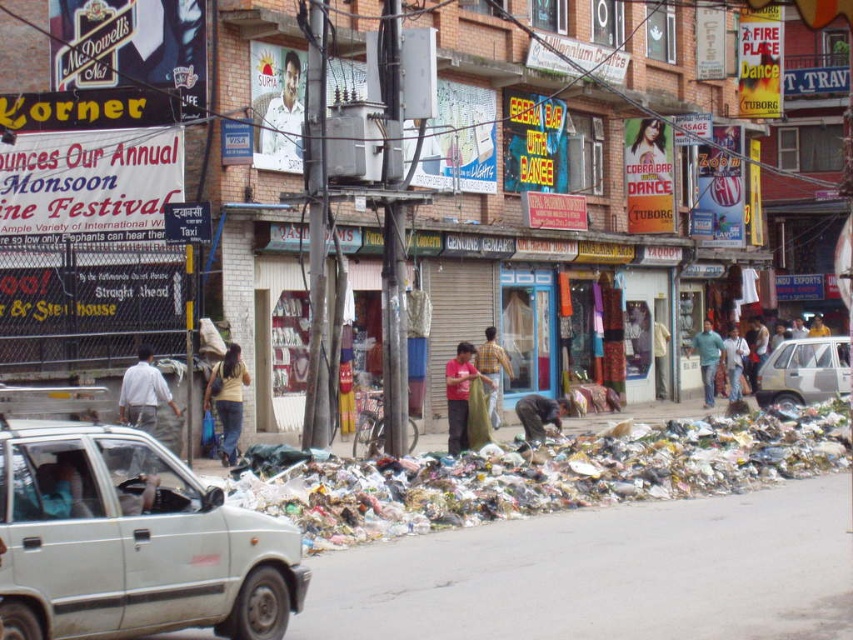
Is the position of white matte suv at lower left less distant than that of green matte shirt at center?

Yes, white matte suv at lower left is closer to the viewer.

Measure the distance between white matte suv at lower left and green matte shirt at center.

They are 74.27 feet apart.

Who is more forward, (230, 522) or (704, 378)?

Point (230, 522) is in front.

The image size is (853, 640). What are the coordinates of `white matte suv at lower left` in the screenshot? It's located at (132, 541).

Between light brown fabric bag at right and light gray fabric pants at center, which one appears on the right side from the viewer's perspective?

light brown fabric bag at right

Who is lower down, light brown fabric bag at right or light gray fabric pants at center?

light gray fabric pants at center

Identify the location of light brown fabric bag at right. This screenshot has height=640, width=853. (804, 371).

Who is shorter, red cotton shirt at center or green matte shirt at center?

red cotton shirt at center

Is red cotton shirt at center positioned behind green matte shirt at center?

No, it is in front of green matte shirt at center.

In order to click on red cotton shirt at center in this screenshot , I will do `click(465, 401)`.